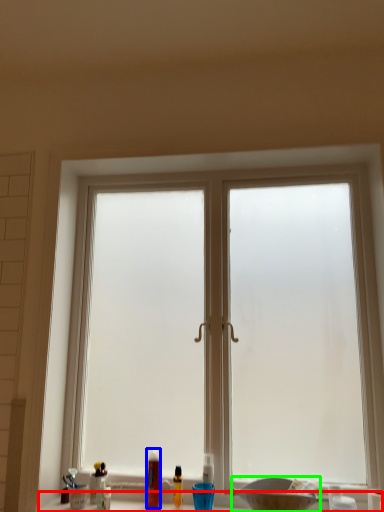
Question: Based on their relative distances, which object is nearer to counter top (highlighted by a red box)? Choose from toiletry (highlighted by a blue box) and basin (highlighted by a green box).

Choices:
 (A) toiletry
 (B) basin

Answer: (A)